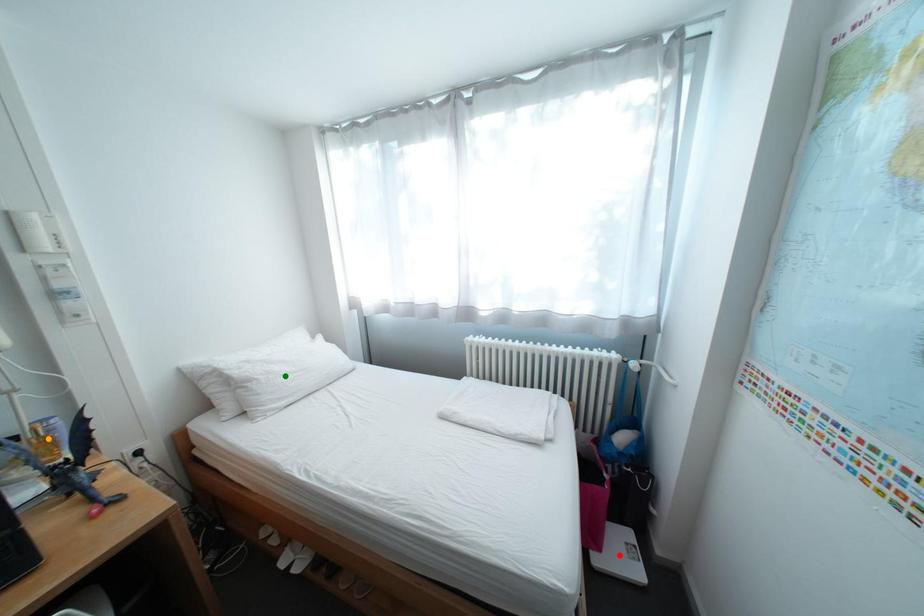
Order these from nearest to farthest:
red point
orange point
green point

orange point → red point → green point